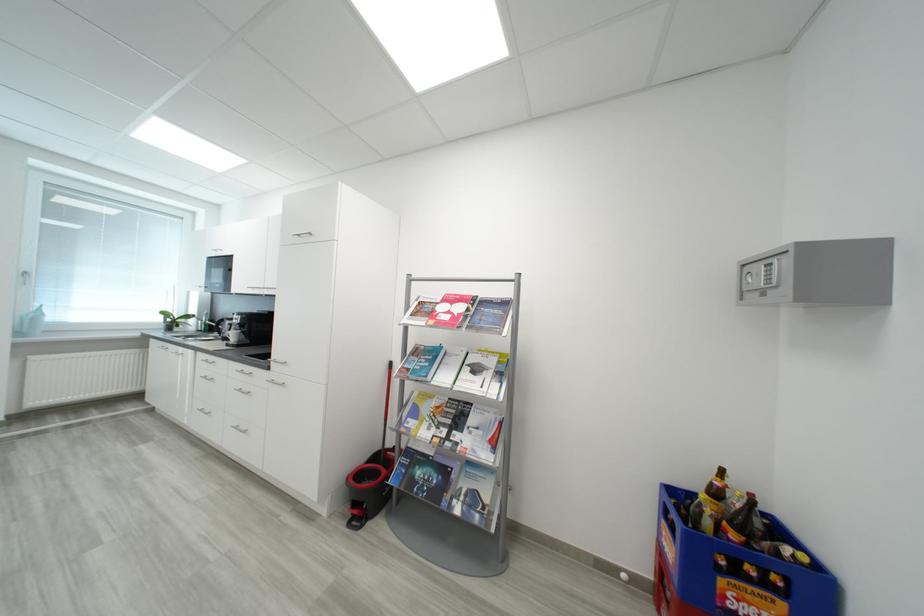
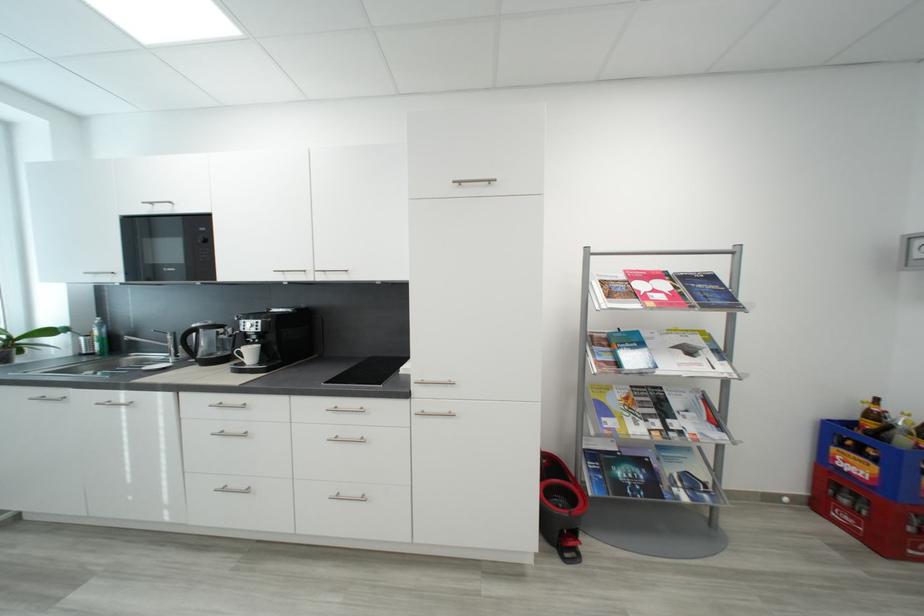
Locate, in the second image, the point that corresponds to [240,336] in the first image.

(257, 354)